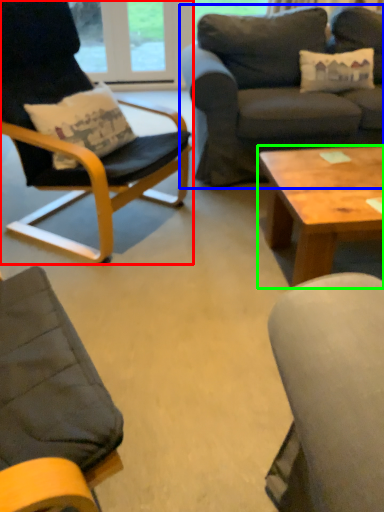
Question: Which is nearer to the chair (highlighted by a red box)? studio couch (highlighted by a blue box) or coffee table (highlighted by a green box).

Choices:
 (A) studio couch
 (B) coffee table

Answer: (B)